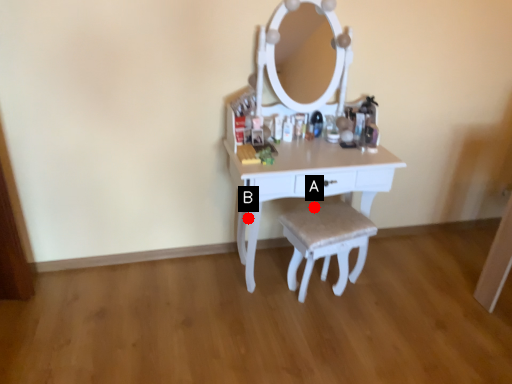
Question: Two points are circled on the image, labeled by A and B beside each circle. Which point is closer to the camera?

Choices:
 (A) A is closer
 (B) B is closer

Answer: (A)